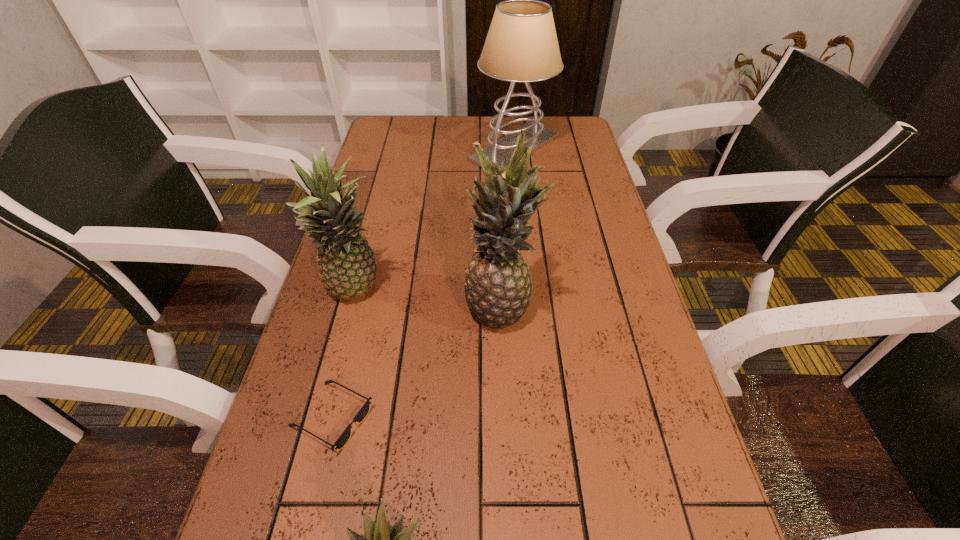
Where is `table lamp`? The width and height of the screenshot is (960, 540). table lamp is located at coordinates (521, 46).

Find the location of `the rightmost pineapple`. the rightmost pineapple is located at coordinates (498, 285).

At what (x,y) coordinates should I click in order to perform the action: click on the leftmost pineapple. Please return your answer as a coordinate pair (x, y). Looking at the image, I should click on pyautogui.click(x=347, y=265).

Find the location of a particular element. The height and width of the screenshot is (540, 960). sunglasses is located at coordinates tap(363, 412).

The height and width of the screenshot is (540, 960). I want to click on the shortest object, so click(363, 412).

What are the coordinates of `free location located 0.230m on the left of the table lamp` in the screenshot? It's located at (401, 148).

Locate an element on the screen. The image size is (960, 540). vacant region located 0.340m on the back of the rightmost pineapple is located at coordinates (496, 199).

Find the location of a particular element. The width and height of the screenshot is (960, 540). blank space located on the right of the leftmost pineapple is located at coordinates (493, 293).

Where is `blank area located on the lenses of the sunglasses`? Image resolution: width=960 pixels, height=540 pixels. blank area located on the lenses of the sunglasses is located at coordinates (416, 418).

You are a GUI agent. You are given a task and a screenshot of the screen. Output one action in this format:
    pyautogui.click(x=<x>, y=<y>)
    Task: Click on the object at the far edge
    The image size is (960, 540).
    Given the screenshot: What is the action you would take?
    pyautogui.click(x=521, y=46)